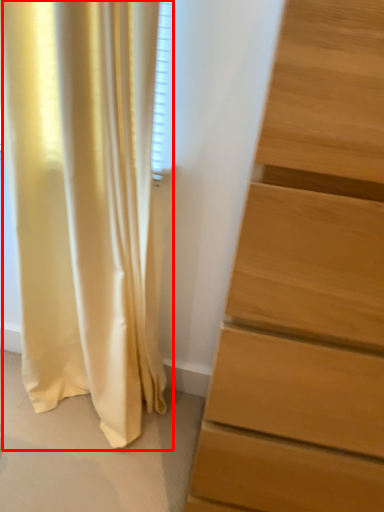
Question: From the image's perspective, considering the relative positions of curtain (annotated by the red box) and chest of drawers in the image provided, where is curtain (annotated by the red box) located with respect to the staircase?

Choices:
 (A) above
 (B) below

Answer: (A)